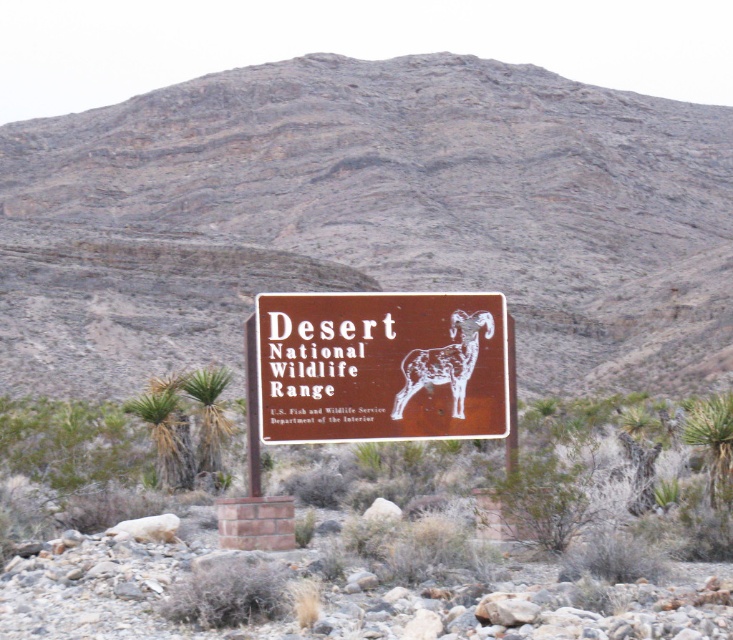
You are navigating a desert trail and see the brown matte sign at center. If you want to reach the sign from your current position, which direction should you move relative to the sign?

The brown matte sign at center is located at point coordinates, but without specific directional information, I can only confirm it is centrally positioned in the image. To reach it, move towards the center of the scene.

You are a hiker in the desert and notice the brown matte sign at center and the white textured ram at center. Which object is located to the right of the other?

The white textured ram at center is located to the right of the brown matte sign at center.

You are standing in front of the signboard in the desert. There are two points marked on the signboard at coordinates point (501, 337) and point (441, 376). Which point is closer to the top edge of the signboard?

Point (501, 337) is closer to the top edge of the signboard because it has a lower y coordinate value than point (441, 376). In image coordinate systems, lower y values correspond to positions higher up on the screen.